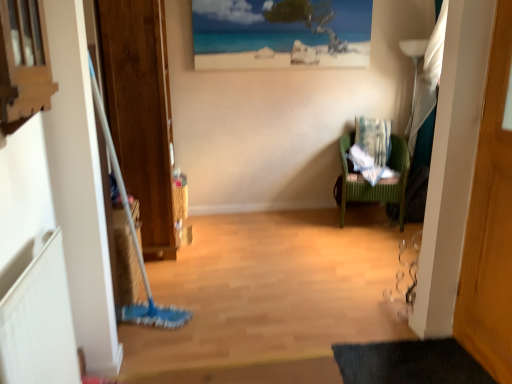
The image size is (512, 384). I want to click on free space to the right of wooden screen door at left, so click(234, 238).